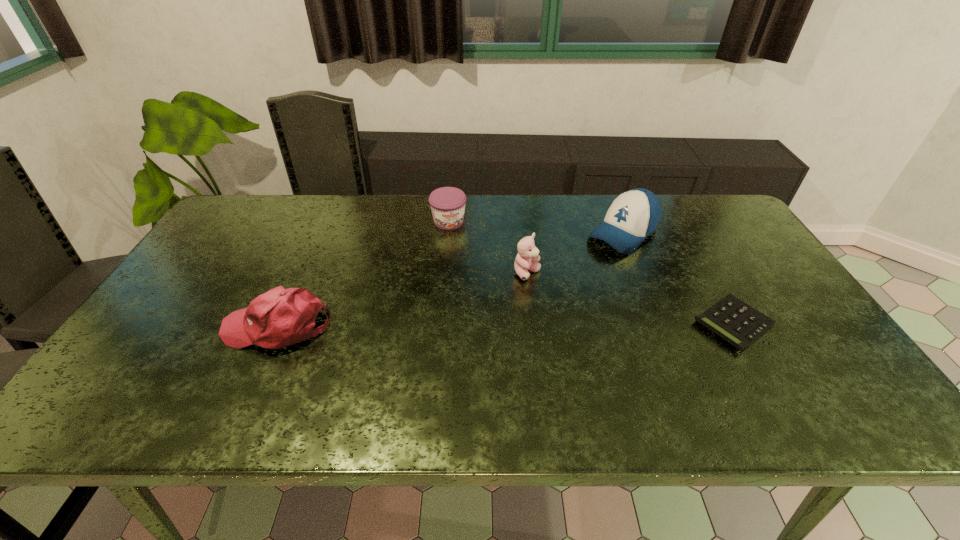
You are a GUI agent. You are given a task and a screenshot of the screen. Output one action in this format:
    pyautogui.click(x=<x>, y=<y>)
    Task: Click on the vacant region located 0.070m at the front of the nearer baseball cap with the brim
    This screenshot has height=540, width=960.
    Given the screenshot: What is the action you would take?
    pyautogui.click(x=196, y=327)

Identify the location of free space located 0.290m on the left of the calculator. Image resolution: width=960 pixels, height=540 pixels. pos(579,323).

Locate an element on the screen. The height and width of the screenshot is (540, 960). vacant space located on the front label of the fourth tallest object is located at coordinates (484, 303).

I want to click on blank space located on the front label of the fourth tallest object, so [463, 253].

Where is `vacant space located 0.350m on the front label of the fourth tallest object`? vacant space located 0.350m on the front label of the fourth tallest object is located at coordinates (487, 308).

Where is `free spot located at the face of the teddy bear`? Image resolution: width=960 pixels, height=540 pixels. free spot located at the face of the teddy bear is located at coordinates (562, 312).

I want to click on free space located 0.080m at the face of the teddy bear, so click(551, 300).

Identify the location of vacant space situated 0.140m at the face of the teddy bear. This screenshot has height=540, width=960. (564, 314).

Where is `free space located 0.060m on the front-facing side of the right baseball cap`? This screenshot has width=960, height=540. free space located 0.060m on the front-facing side of the right baseball cap is located at coordinates 590,259.

What are the coordinates of `free point located 0.310m on the front-facing side of the right baseball cap` in the screenshot? It's located at (538, 302).